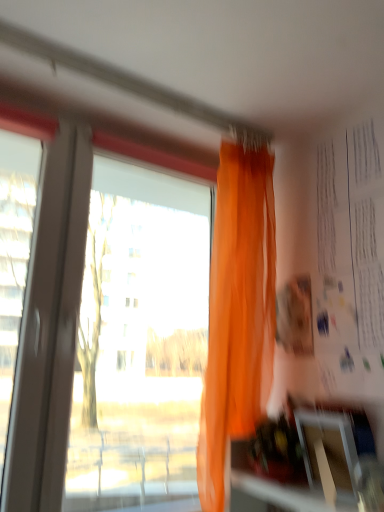
Identify the location of transparent plastic window screen at lower right. The image size is (384, 512). (328, 453).

Find the location of a particular element. white paper at upper right is located at coordinates (350, 261).

Which object is thinner, orange sheer curtain at upper center or white paper at upper right?

white paper at upper right.

From the image's perspective, is orange sheer curtain at upper center located above white paper at upper right?

No, from the image's perspective, orange sheer curtain at upper center is not on top of white paper at upper right.

Is orange sheer curtain at upper center looking in the opposite direction of white paper at upper right?

No.

From a real-world perspective, is orange sheer curtain at upper center positioned above or below white paper at upper right?

Clearly, from a real-world perspective, orange sheer curtain at upper center is below white paper at upper right.

From a real-world perspective, is orange sheer curtain at upper center on top of transparent glass window at upper left?

Indeed, from a real-world perspective, orange sheer curtain at upper center stands above transparent glass window at upper left.

Between orange sheer curtain at upper center and transparent glass window at upper left, which one has smaller size?

orange sheer curtain at upper center is smaller.

Does point (260, 273) come behind point (77, 436)?

No, it is not.

Is orange sheer curtain at upper center facing towards transparent plastic window screen at lower right?

Yes, orange sheer curtain at upper center is oriented towards transparent plastic window screen at lower right.

Considering the positions of objects orange sheer curtain at upper center and transparent plastic window screen at lower right in the image provided, who is more to the right, orange sheer curtain at upper center or transparent plastic window screen at lower right?

From the viewer's perspective, transparent plastic window screen at lower right appears more on the right side.

From a real-world perspective, is orange sheer curtain at upper center positioned above or below transparent plastic window screen at lower right?

From a real-world perspective, orange sheer curtain at upper center is physically above transparent plastic window screen at lower right.

Is orange sheer curtain at upper center touching transparent plastic window screen at lower right?

orange sheer curtain at upper center and transparent plastic window screen at lower right are not in contact.

Could you tell me if white paper at upper right is turned towards transparent plastic window screen at lower right?

No, white paper at upper right is not aimed at transparent plastic window screen at lower right.

Where is `bulletin board above the transparent plastic window screen at lower right (from the image's perspective)`? This screenshot has height=512, width=384. bulletin board above the transparent plastic window screen at lower right (from the image's perspective) is located at coordinates (350, 261).

Is white paper at upper right next to transparent plastic window screen at lower right and touching it?

No, white paper at upper right is not beside transparent plastic window screen at lower right.

Based on their sizes in the image, would you say transparent plastic window screen at lower right is bigger or smaller than orange sheer curtain at upper center?

In the image, transparent plastic window screen at lower right appears to be smaller than orange sheer curtain at upper center.

Which point is more forward, (305, 437) or (215, 296)?

Point (305, 437)

You are a GUI agent. You are given a task and a screenshot of the screen. Output one action in this format:
    pyautogui.click(x=<x>, y=<y>)
    Task: Click on the window screen below the orange sheer curtain at upper center (from the image's perspective)
    The image size is (384, 512).
    Given the screenshot: What is the action you would take?
    pyautogui.click(x=328, y=453)

Is transparent plastic window screen at lower right with orange sheer curtain at upper center?

They are not placed beside each other.

Is transparent glass window at upper left in front of or behind orange sheer curtain at upper center in the image?

In the image, transparent glass window at upper left appears in front of orange sheer curtain at upper center.

From the image's perspective, which is above, transparent glass window at upper left or orange sheer curtain at upper center?

transparent glass window at upper left, from the image's perspective.

How different are the orientations of transparent glass window at upper left and orange sheer curtain at upper center in degrees?

There is a 1.38-degree angle between the facing directions of transparent glass window at upper left and orange sheer curtain at upper center.

Does transparent glass window at upper left turn towards orange sheer curtain at upper center?

Yes, transparent glass window at upper left is oriented towards orange sheer curtain at upper center.

Is white paper at upper right oriented towards transparent glass window at upper left?

No, white paper at upper right does not turn towards transparent glass window at upper left.

Locate an element on the screen. This screenshot has width=384, height=512. window in front of the white paper at upper right is located at coordinates (99, 324).

Relative to transparent glass window at upper left, is white paper at upper right in front or behind?

white paper at upper right is positioned farther from the viewer than transparent glass window at upper left.

Is white paper at upper right placed right next to transparent glass window at upper left?

No, white paper at upper right is not in contact with transparent glass window at upper left.

Where is `bulletin board above the orange sheer curtain at upper center (from the image's perspective)`? bulletin board above the orange sheer curtain at upper center (from the image's perspective) is located at coordinates (350, 261).

You are a GUI agent. You are given a task and a screenshot of the screen. Output one action in this format:
    pyautogui.click(x=<x>, y=<y>)
    Task: Click on the curtain below the transparent glass window at upper left (from the image's perspective)
    The image size is (384, 512).
    Given the screenshot: What is the action you would take?
    pyautogui.click(x=238, y=312)

Estimate the real-world distances between objects in this image. Which object is closer to transparent plastic window screen at lower right, transparent glass window at upper left or white paper at upper right?

white paper at upper right.

When comparing their distances from orange sheer curtain at upper center, does transparent plastic window screen at lower right or transparent glass window at upper left seem further?

Based on the image, transparent glass window at upper left appears to be further to orange sheer curtain at upper center.

Considering their positions, is orange sheer curtain at upper center positioned further to transparent glass window at upper left than transparent plastic window screen at lower right?

transparent plastic window screen at lower right.

Considering their positions, is transparent plastic window screen at lower right positioned closer to white paper at upper right than transparent glass window at upper left?

transparent plastic window screen at lower right lies closer to white paper at upper right than the other object.

When comparing their distances from orange sheer curtain at upper center, does white paper at upper right or transparent glass window at upper left seem further?

transparent glass window at upper left is further to orange sheer curtain at upper center.

From the image, which object appears to be nearer to transparent glass window at upper left, white paper at upper right or orange sheer curtain at upper center?

orange sheer curtain at upper center is positioned closer to the anchor transparent glass window at upper left.

When comparing their distances from transparent glass window at upper left, does orange sheer curtain at upper center or white paper at upper right seem closer?

orange sheer curtain at upper center is positioned closer to the anchor transparent glass window at upper left.

Considering their positions, is transparent plastic window screen at lower right positioned further to orange sheer curtain at upper center than white paper at upper right?

Based on the image, transparent plastic window screen at lower right appears to be further to orange sheer curtain at upper center.

Identify the location of curtain between white paper at upper right and transparent plastic window screen at lower right from top to bottom. The width and height of the screenshot is (384, 512). (238, 312).

Image resolution: width=384 pixels, height=512 pixels. I want to click on curtain between transparent glass window at upper left and transparent plastic window screen at lower right from left to right, so tap(238, 312).

This screenshot has height=512, width=384. What are the coordinates of `window screen located between transparent glass window at upper left and white paper at upper right in the left-right direction` in the screenshot? It's located at (328, 453).

Locate an element on the screen. Image resolution: width=384 pixels, height=512 pixels. curtain between transparent glass window at upper left and white paper at upper right in the horizontal direction is located at coordinates (238, 312).